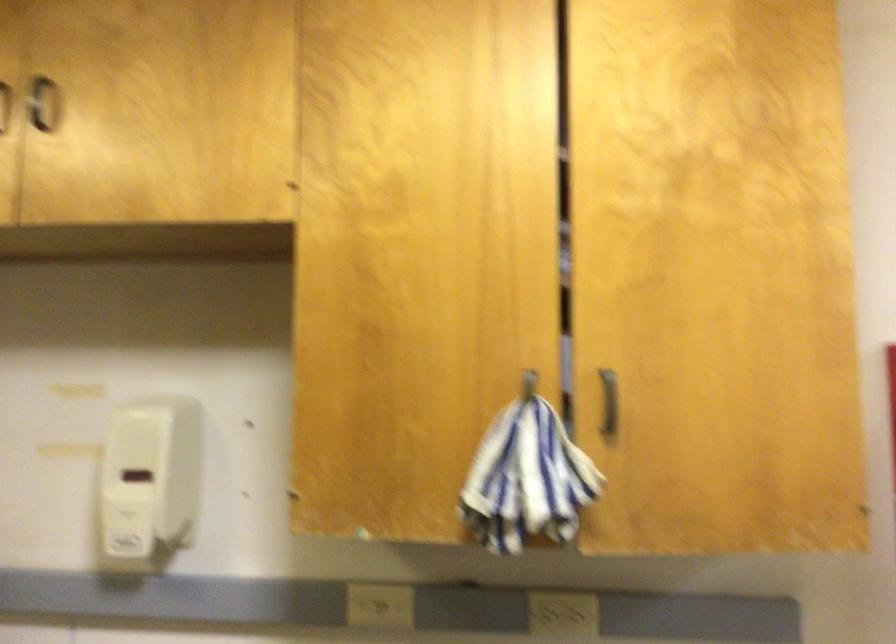
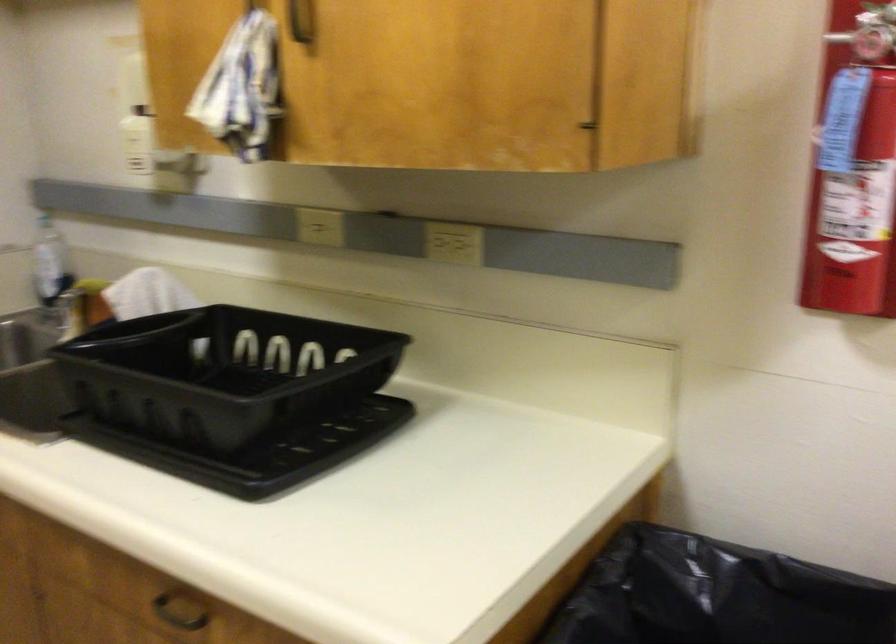
The images are taken continuously from a first-person perspective. In which direction is your viewpoint rotating?

The camera rotated toward left-down.